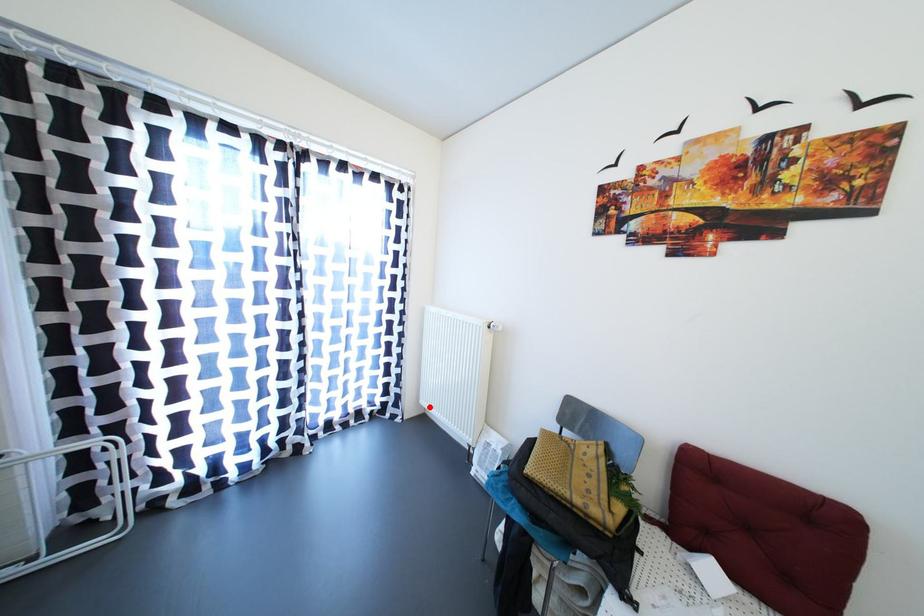
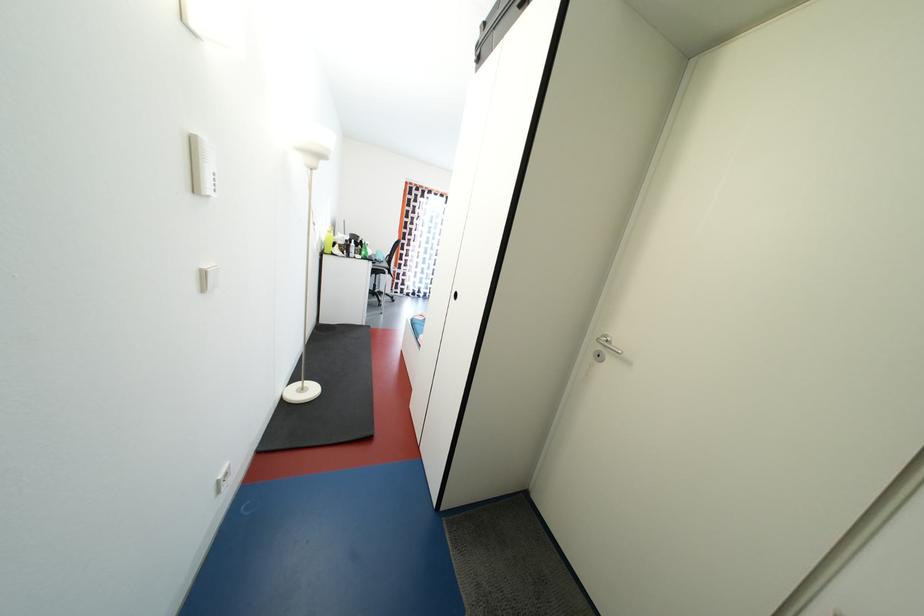
Question: I am providing you with two images of the same scene from different viewpoints. A red point is marked on the first image. At the location where the point appears in image 1, is it still visible in image 2?

Choices:
 (A) Yes
 (B) No

Answer: (B)